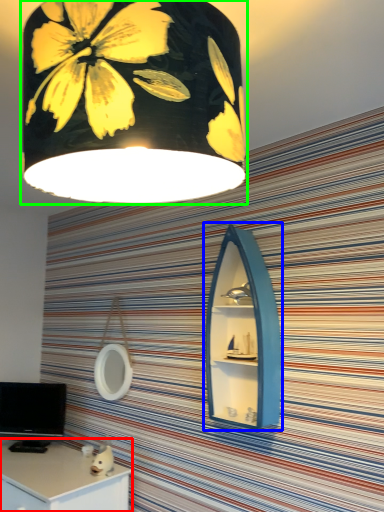
Question: Based on their relative distances, which object is farther from desk (highlighted by a red box)? Choose from medicine cabinet (highlighted by a blue box) and lamp (highlighted by a green box).

Choices:
 (A) medicine cabinet
 (B) lamp

Answer: (B)